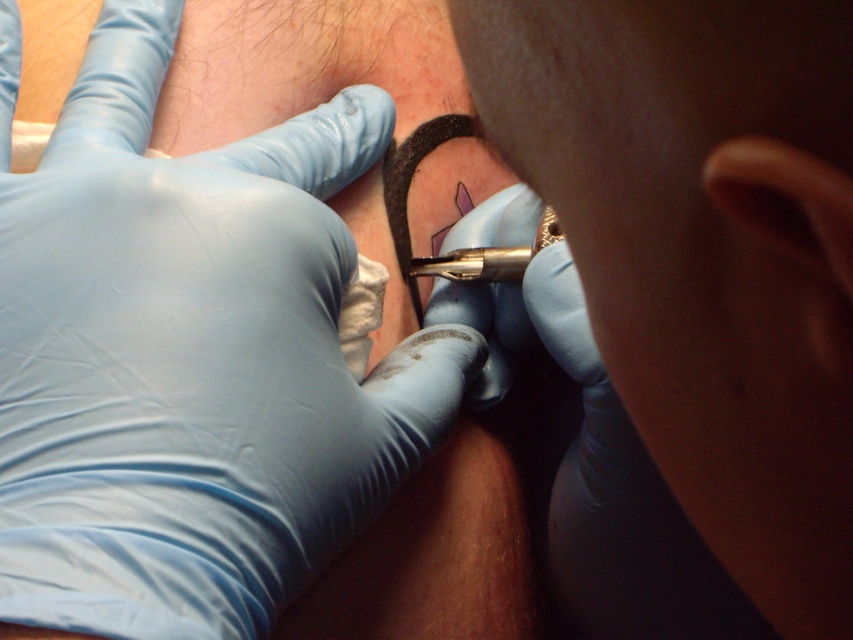
Is blue rubber glove at upper left bigger than blue rubber glove at center?

Yes.

Does point (259, 493) come closer to viewer compared to point (486, 368)?

Yes, it is in front of point (486, 368).

The width and height of the screenshot is (853, 640). In order to click on blue rubber glove at upper left in this screenshot , I will do `click(190, 355)`.